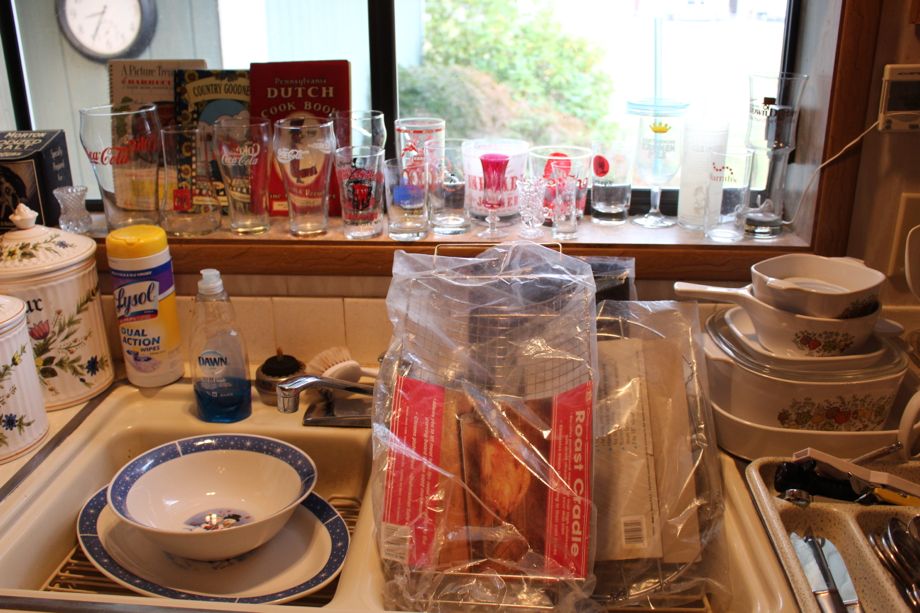
The height and width of the screenshot is (613, 920). I want to click on windows, so click(x=319, y=23), click(x=523, y=46).